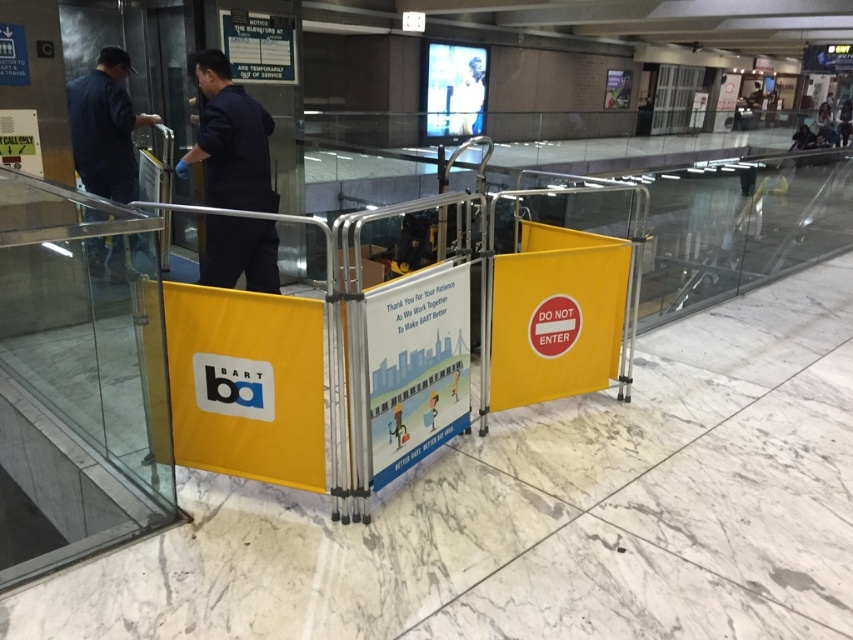
Question: Considering the relative positions of dark blue uniform at center and dark blue uniform at left in the image provided, where is dark blue uniform at center located with respect to dark blue uniform at left?

Choices:
 (A) right
 (B) left

Answer: (A)

Question: Which of the following is the farthest from the observer?

Choices:
 (A) (271, 262)
 (B) (115, 189)

Answer: (B)

Question: Considering the relative positions of dark blue uniform at center and dark blue uniform at left in the image provided, where is dark blue uniform at center located with respect to dark blue uniform at left?

Choices:
 (A) right
 (B) left

Answer: (A)

Question: Is dark blue uniform at center closer to camera compared to dark blue uniform at left?

Choices:
 (A) no
 (B) yes

Answer: (B)